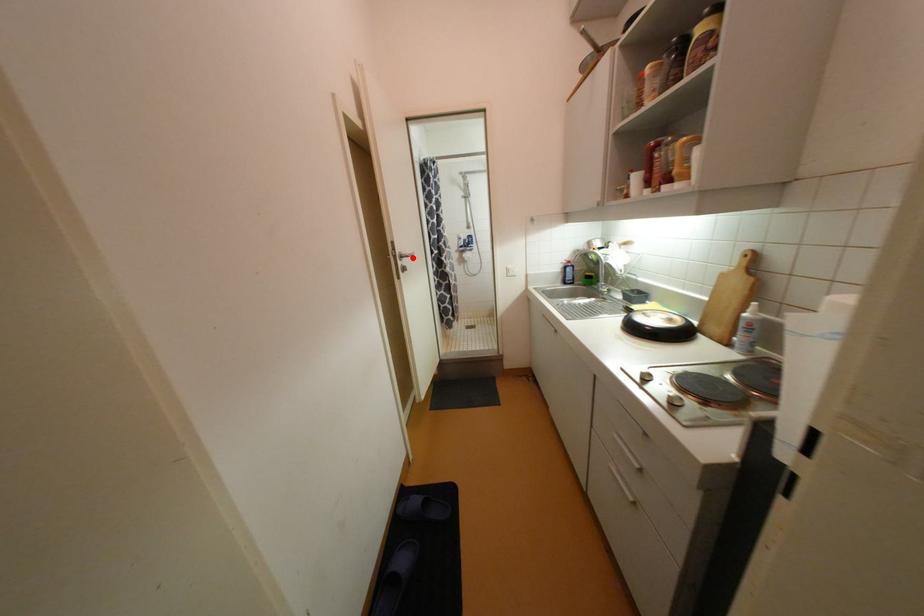
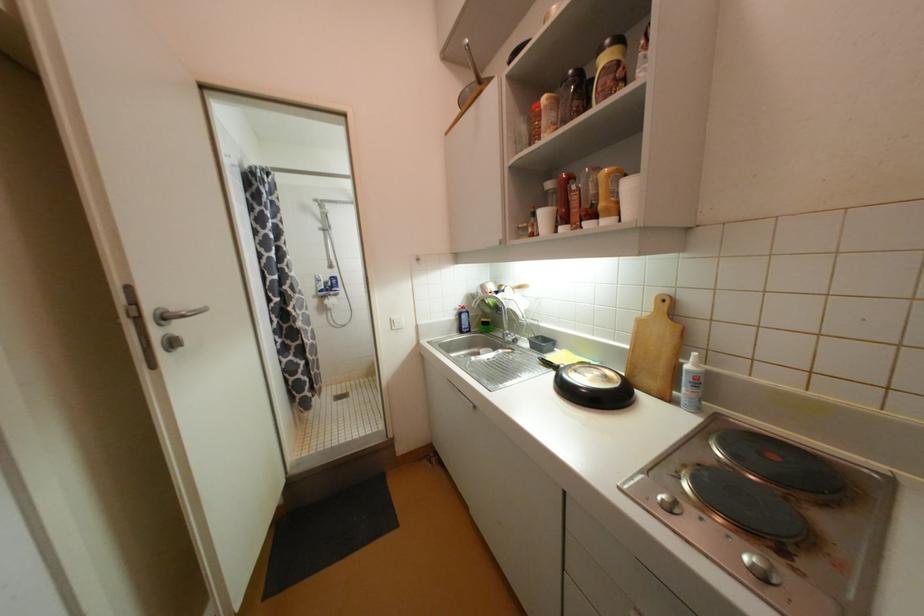
Question: I am providing you with two images of the same scene from different viewpoints. Image1 has a red point marked. In image2, the corresponding 3D location appears at what relative position? Reply with the corresponding letter.

Choices:
 (A) Closer
 (B) Farther

Answer: (B)